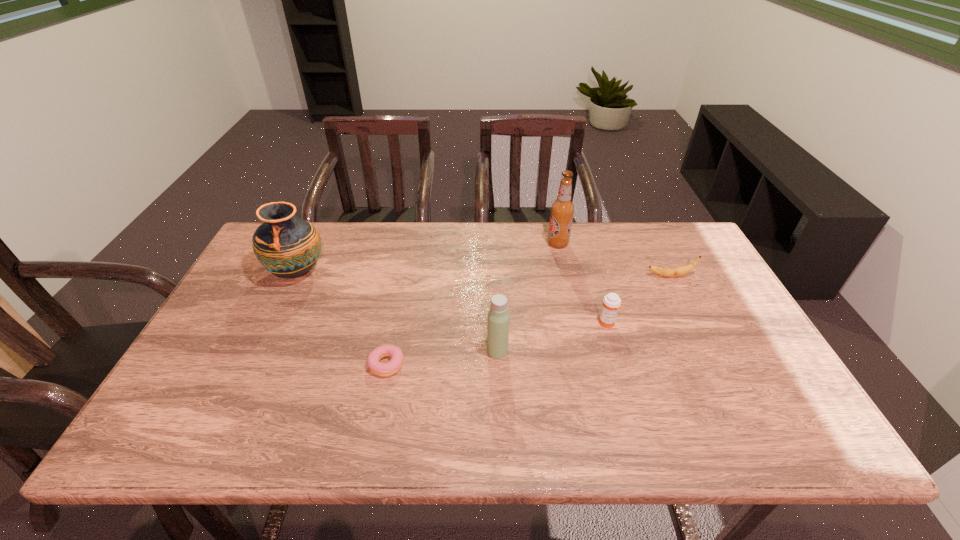
This screenshot has width=960, height=540. In order to click on vacant space that's between the second object from left to right and the pottery in this screenshot , I will do `click(342, 318)`.

Identify which object is the fifth closest to the fourth shortest object. Please provide its 2D coordinates. Your answer should be formatted as a tuple, i.e. [(x, y)], where the tuple contains the x and y coordinates of a point satisfying the conditions above.

[(286, 246)]

Identify the location of the fifth closest object to the fifth tallest object. This screenshot has height=540, width=960. (286, 246).

Find the location of a particular element. This screenshot has width=960, height=540. vacant space that satisfies the following two spatial constraints: 1. on the front side of the pottery; 2. on the right side of the shortest object is located at coordinates (252, 364).

At what (x,y) coordinates should I click in order to perform the action: click on vacant space that satisfies the following two spatial constraints: 1. on the front label of the medicine; 2. on the left side of the beer bottle. Please return your answer as a coordinate pair (x, y). The width and height of the screenshot is (960, 540). Looking at the image, I should click on (576, 323).

Identify the location of free space that satisfies the following two spatial constraints: 1. on the front label of the farthest object; 2. on the front side of the fourth object from right to left. (582, 350).

Locate an element on the screen. free point that satisfies the following two spatial constraints: 1. on the front side of the leftmost object; 2. on the right side of the second object from right to left is located at coordinates (272, 323).